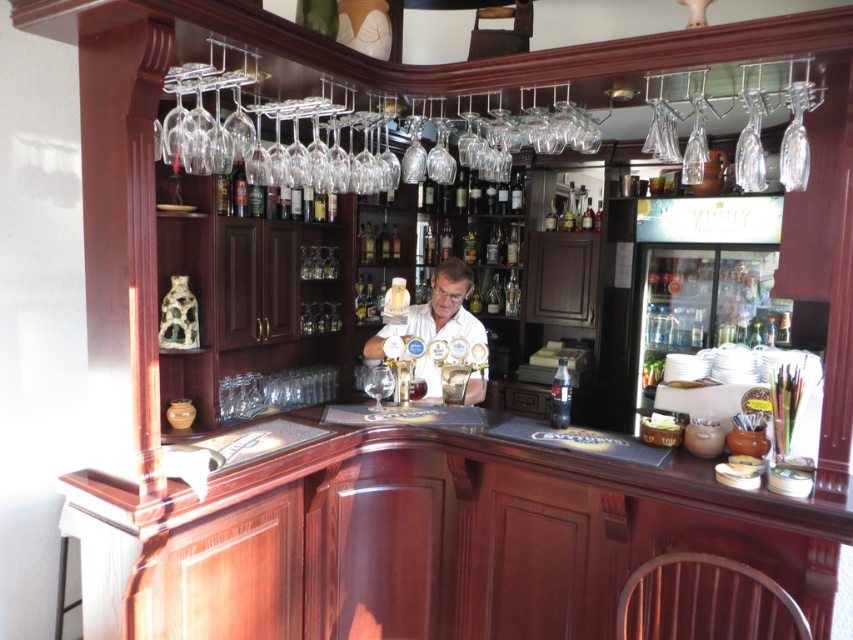
Question: Is clear plastic bottle at center positioned behind transparent glass wine glass at center?

Choices:
 (A) no
 (B) yes

Answer: (A)

Question: Which is farther from the white matte shirt at center?

Choices:
 (A) clear plastic bottle at center
 (B) transparent glass wine glass at center

Answer: (A)

Question: Which point is closer to the camera taking this photo?

Choices:
 (A) (474, 372)
 (B) (561, 368)

Answer: (B)

Question: Is white matte shirt at center positioned in front of transparent glass wine glass at center?

Choices:
 (A) yes
 (B) no

Answer: (A)

Question: Which object is closer to the camera taking this photo?

Choices:
 (A) white matte shirt at center
 (B) clear plastic bottle at center

Answer: (B)

Question: Is white matte shirt at center above transparent glass wine glass at center?

Choices:
 (A) yes
 (B) no

Answer: (A)